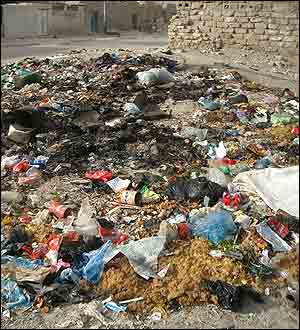
Locate an element on the screen. Image resolution: width=300 pixels, height=330 pixels. wall is located at coordinates (223, 23).